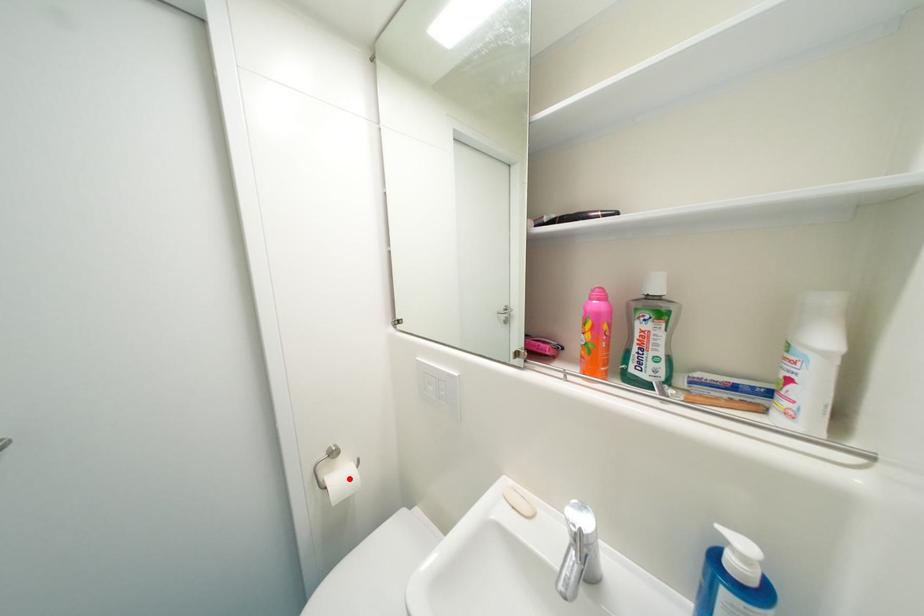
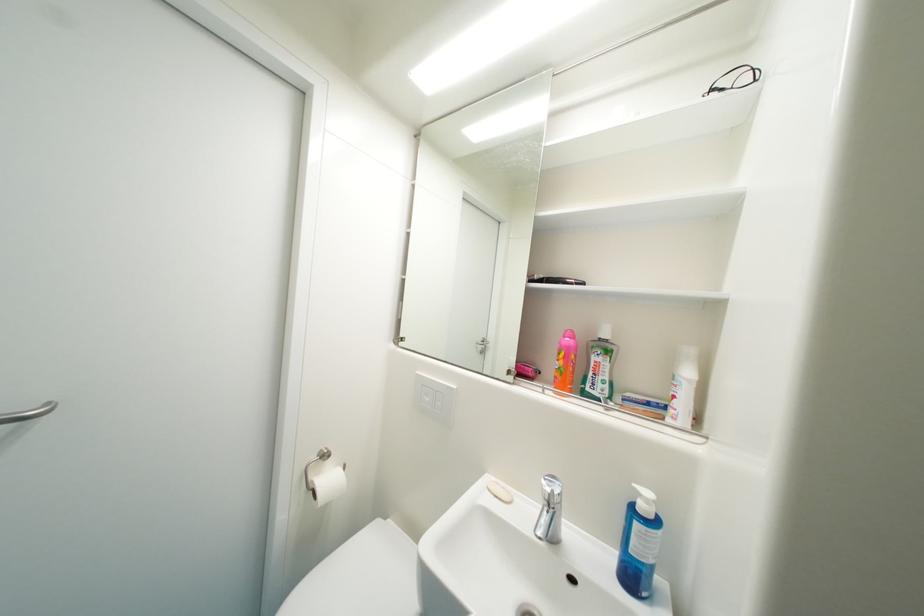
Where in the second image is the point corresponding to the highlighted location from the first image?

(337, 482)